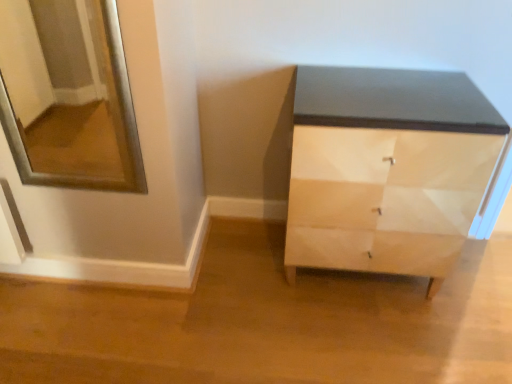
This screenshot has width=512, height=384. What do you see at coordinates (380, 207) in the screenshot?
I see `white glossy drawer at lower right` at bounding box center [380, 207].

Where is `silver/metallic mirror at upper left`? silver/metallic mirror at upper left is located at coordinates (68, 95).

Which object is thinner, white glossy drawer at lower right or silver/metallic mirror at upper left?

white glossy drawer at lower right.

From a real-world perspective, which object stands above the other?

silver/metallic mirror at upper left, from a real-world perspective.

In terms of size, does white glossy drawer at lower right appear bigger or smaller than silver/metallic mirror at upper left?

white glossy drawer at lower right is smaller than silver/metallic mirror at upper left.

Find the location of `drawer below the silver/metallic mirror at upper left (from a real-world perspective)`. drawer below the silver/metallic mirror at upper left (from a real-world perspective) is located at coordinates (380, 207).

From a real-world perspective, is matte black cabinet at center physically above white glossy drawer at lower right?

Yes, from a real-world perspective, matte black cabinet at center is above white glossy drawer at lower right.

Between matte black cabinet at center and white glossy drawer at lower right, which one is positioned in front?

matte black cabinet at center.

Is matte black cabinet at center inside or outside of white glossy drawer at lower right?

matte black cabinet at center exists outside the volume of white glossy drawer at lower right.

Is matte black cabinet at center facing away from white glossy drawer at lower right?

Correct, matte black cabinet at center is looking away from white glossy drawer at lower right.

Which of these two, matte black cabinet at center or silver/metallic mirror at upper left, stands taller?

Standing taller between the two is matte black cabinet at center.

Do you think matte black cabinet at center is within silver/metallic mirror at upper left, or outside of it?

matte black cabinet at center is outside silver/metallic mirror at upper left.

Is matte black cabinet at center oriented away from silver/metallic mirror at upper left?

No, silver/metallic mirror at upper left is not at the back of matte black cabinet at center.

Can you tell me how much matte black cabinet at center and silver/metallic mirror at upper left differ in facing direction?

The angle between the facing direction of matte black cabinet at center and the facing direction of silver/metallic mirror at upper left is 0.482 degrees.

Considering the relative positions of silver/metallic mirror at upper left and matte black cabinet at center in the image provided, is silver/metallic mirror at upper left to the left of matte black cabinet at center from the viewer's perspective?

Yes, silver/metallic mirror at upper left is to the left of matte black cabinet at center.

Does point (82, 9) come closer to viewer compared to point (323, 247)?

That is False.

Is silver/metallic mirror at upper left taller than matte black cabinet at center?

No.

In terms of size, does silver/metallic mirror at upper left appear bigger or smaller than matte black cabinet at center?

silver/metallic mirror at upper left is smaller than matte black cabinet at center.

Is point (469, 211) behind point (325, 258)?

No.

Can you tell me how much white glossy drawer at lower right and matte black cabinet at center differ in facing direction?

The facing directions of white glossy drawer at lower right and matte black cabinet at center are 0.0792 degrees apart.

Consider the image. From the image's perspective, does white glossy drawer at lower right appear higher than matte black cabinet at center?

No, from the image's perspective, white glossy drawer at lower right is not on top of matte black cabinet at center.

Looking at the image, does silver/metallic mirror at upper left seem bigger or smaller compared to white glossy drawer at lower right?

silver/metallic mirror at upper left is bigger than white glossy drawer at lower right.

Is silver/metallic mirror at upper left at the left side of white glossy drawer at lower right?

Indeed, silver/metallic mirror at upper left is positioned on the left side of white glossy drawer at lower right.

Is silver/metallic mirror at upper left looking in the opposite direction of white glossy drawer at lower right?

No, silver/metallic mirror at upper left's orientation is not away from white glossy drawer at lower right.

The width and height of the screenshot is (512, 384). Identify the location of drawer beneath the silver/metallic mirror at upper left (from a real-world perspective). (380, 207).

Find the location of a particular element. drawer located on the left of matte black cabinet at center is located at coordinates (380, 207).

Looking at this image, which object lies further to the anchor point matte black cabinet at center, silver/metallic mirror at upper left or white glossy drawer at lower right?

Based on the image, silver/metallic mirror at upper left appears to be further to matte black cabinet at center.

Based on their spatial positions, is matte black cabinet at center or silver/metallic mirror at upper left further from white glossy drawer at lower right?

silver/metallic mirror at upper left is further to white glossy drawer at lower right.

Which object lies nearer to the anchor point silver/metallic mirror at upper left, white glossy drawer at lower right or matte black cabinet at center?

matte black cabinet at center is positioned closer to the anchor silver/metallic mirror at upper left.

Based on their spatial positions, is white glossy drawer at lower right or silver/metallic mirror at upper left closer to matte black cabinet at center?

white glossy drawer at lower right is closer to matte black cabinet at center.

Based on their spatial positions, is matte black cabinet at center or white glossy drawer at lower right further from silver/metallic mirror at upper left?

white glossy drawer at lower right is positioned further to the anchor silver/metallic mirror at upper left.

Looking at the image, which one is located further to white glossy drawer at lower right, silver/metallic mirror at upper left or matte black cabinet at center?

silver/metallic mirror at upper left is positioned further to the anchor white glossy drawer at lower right.

Find the location of a particular element. The width and height of the screenshot is (512, 384). drawer situated between silver/metallic mirror at upper left and matte black cabinet at center from left to right is located at coordinates (380, 207).